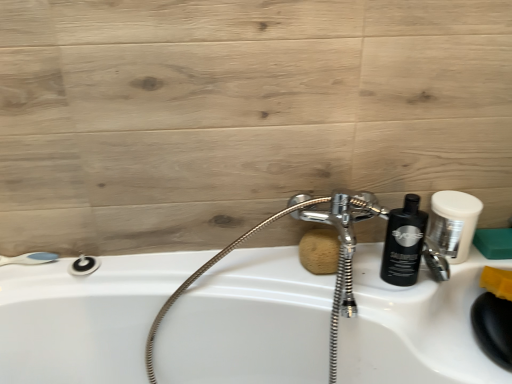
Question: Does point click(34, 256) appear closer or farther from the camera than point click(89, 268)?

Choices:
 (A) closer
 (B) farther

Answer: (B)

Question: In terms of width, does white plastic shower at left, the 2th shower viewed from the right, look wider or thinner when compared to matte black shower at lower left, arranged as the first shower when viewed from the right?

Choices:
 (A) thin
 (B) wide

Answer: (A)

Question: Estimate the real-world distances between objects in this image. Which object is closer to the white matte shaving cream at upper right?

Choices:
 (A) green sponge at right, marked as the 1th soap in a right-to-left arrangement
 (B) white plastic shower at left, placed as the 1th shower when sorted from left to right
 (C) black glossy bottle at right
 (D) brown sponge at center, arranged as the second soap when viewed from the right
 (E) matte black shower at lower left, the second shower when ordered from left to right

Answer: (C)

Question: Estimate the real-world distances between objects in this image. Which object is farther from the brown sponge at center, arranged as the second soap when viewed from the right?

Choices:
 (A) white matte shaving cream at upper right
 (B) green sponge at right, which ranks as the second soap in left-to-right order
 (C) black glossy bottle at right
 (D) white glossy sink at center
 (E) white plastic shower at left, placed as the 1th shower when sorted from left to right

Answer: (E)